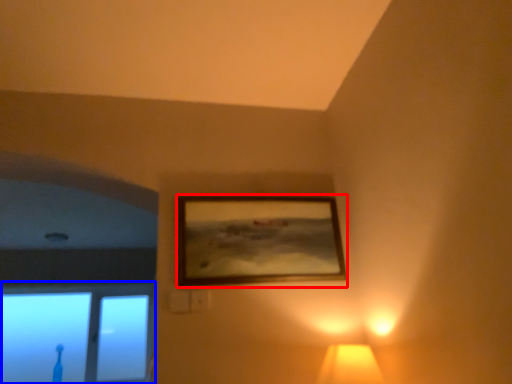
Question: Which of the following is the farthest to the observer, picture frame (highlighted by a red box) or window (highlighted by a blue box)?

Choices:
 (A) picture frame
 (B) window

Answer: (B)